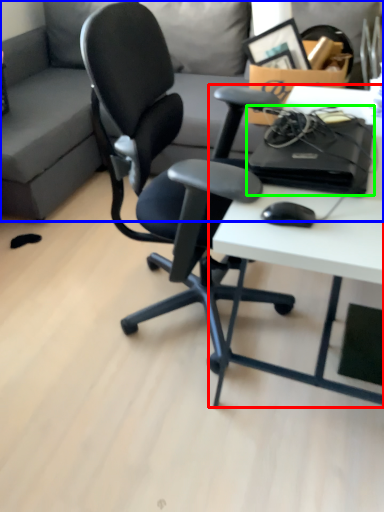
Question: Estimate the real-world distances between objects in this image. Which object is closer to desk (highlighted by a red box), studio couch (highlighted by a blue box) or computer (highlighted by a green box)?

Choices:
 (A) studio couch
 (B) computer

Answer: (B)